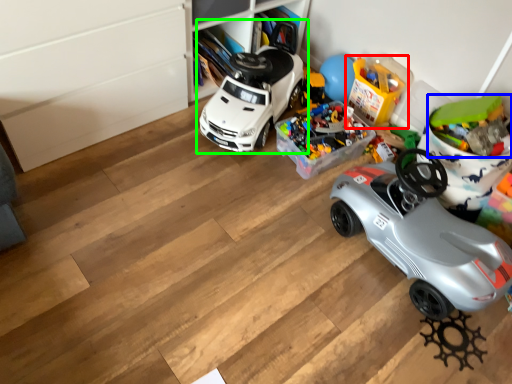
Question: Considering the real-world distances, which object is closest to toy (highlighted by a red box)? toy (highlighted by a blue box) or car (highlighted by a green box).

Choices:
 (A) toy
 (B) car

Answer: (B)